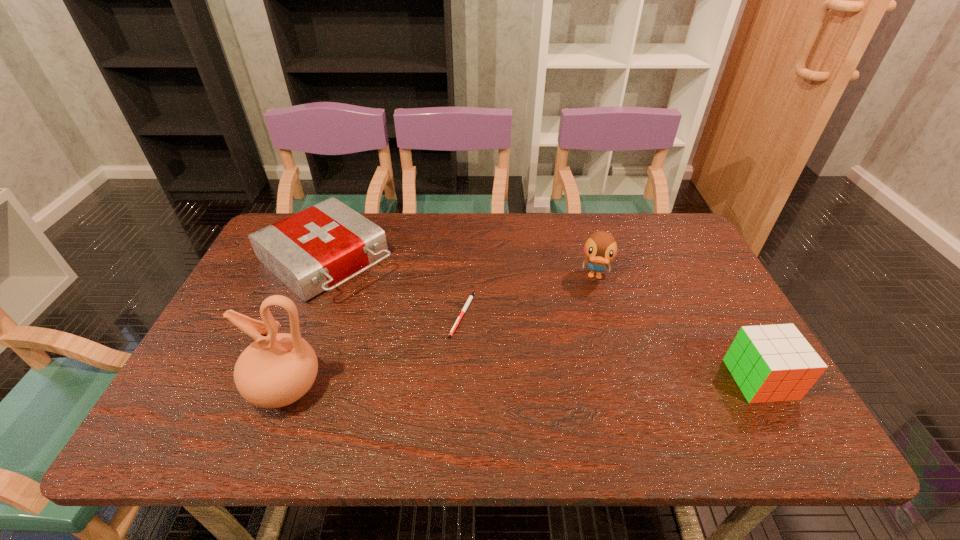
Where is `vacant space on the desktop that is between the pottery and the cube and is positioned on the front side of the second shortest object`? The height and width of the screenshot is (540, 960). vacant space on the desktop that is between the pottery and the cube and is positioned on the front side of the second shortest object is located at coordinates (487, 384).

Locate an element on the screen. The height and width of the screenshot is (540, 960). free space on the desktop that is between the pottery and the rightmost object and is positioned on the clicker of the third object from left to right is located at coordinates (478, 384).

Where is `vacant space on the desktop that is between the pottery and the cube and is positioned on the front-facing side of the fourth object from left to right`? The width and height of the screenshot is (960, 540). vacant space on the desktop that is between the pottery and the cube and is positioned on the front-facing side of the fourth object from left to right is located at coordinates click(585, 383).